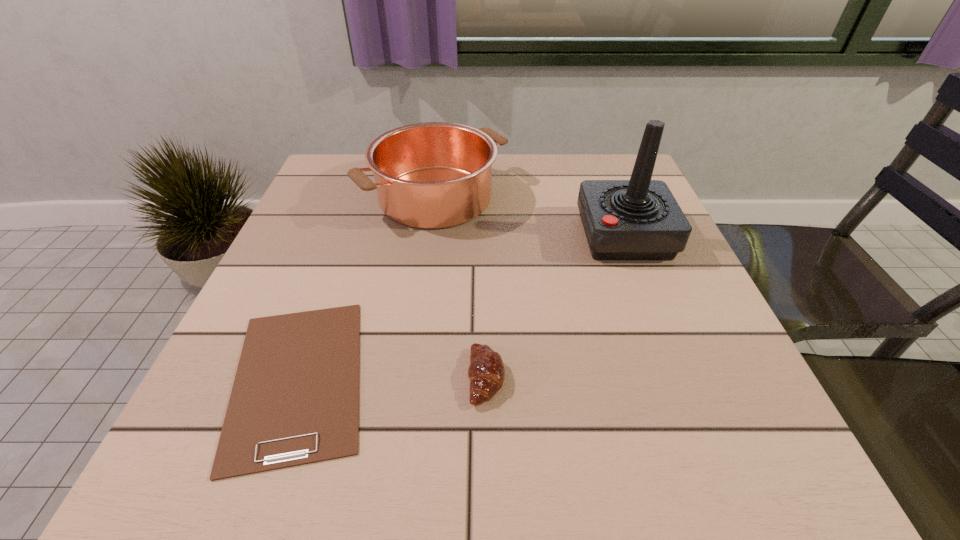
I want to click on the tallest object, so click(638, 219).

The height and width of the screenshot is (540, 960). Find the location of `joystick`. joystick is located at coordinates (638, 219).

Locate an element on the screen. the third shortest object is located at coordinates coord(432,175).

Identify the location of the third tallest object. This screenshot has width=960, height=540. (486, 372).

In order to click on clipboard in this screenshot , I will do `click(295, 398)`.

The image size is (960, 540). What are the coordinates of `vacant space located on the front-facing side of the joystick` in the screenshot? It's located at (484, 235).

This screenshot has height=540, width=960. What are the coordinates of `vacant space located 0.060m on the front-facing side of the joystick` in the screenshot? It's located at (555, 235).

The image size is (960, 540). What are the coordinates of `free space located on the front-facing side of the joystick` in the screenshot? It's located at pyautogui.click(x=414, y=235).

At what (x,y) coordinates should I click in order to perform the action: click on free space located on the right of the third shortest object. Please return your answer as a coordinate pair (x, y). Looking at the image, I should click on (583, 197).

Where is `free space located on the front of the crescent roll`? The height and width of the screenshot is (540, 960). free space located on the front of the crescent roll is located at coordinates (488, 475).